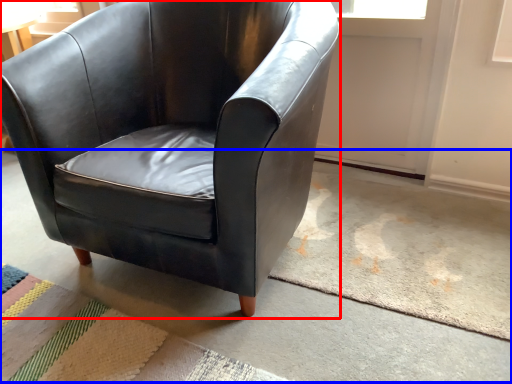
Question: Which object appears farthest to the camera in this image, chair (highlighted by a red box) or concrete (highlighted by a blue box)?

Choices:
 (A) chair
 (B) concrete

Answer: (A)